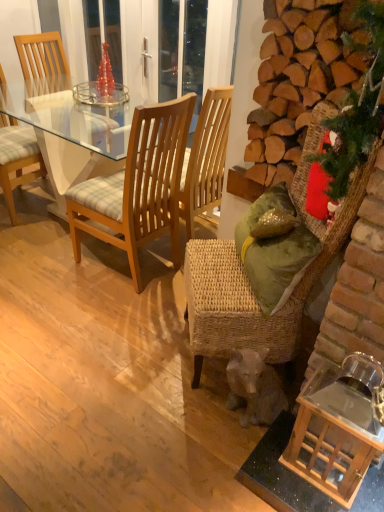
Find the location of `free space in front of woven wicker chair at right, which is counted as the 4th chair, starting from the left`. free space in front of woven wicker chair at right, which is counted as the 4th chair, starting from the left is located at coordinates (186, 447).